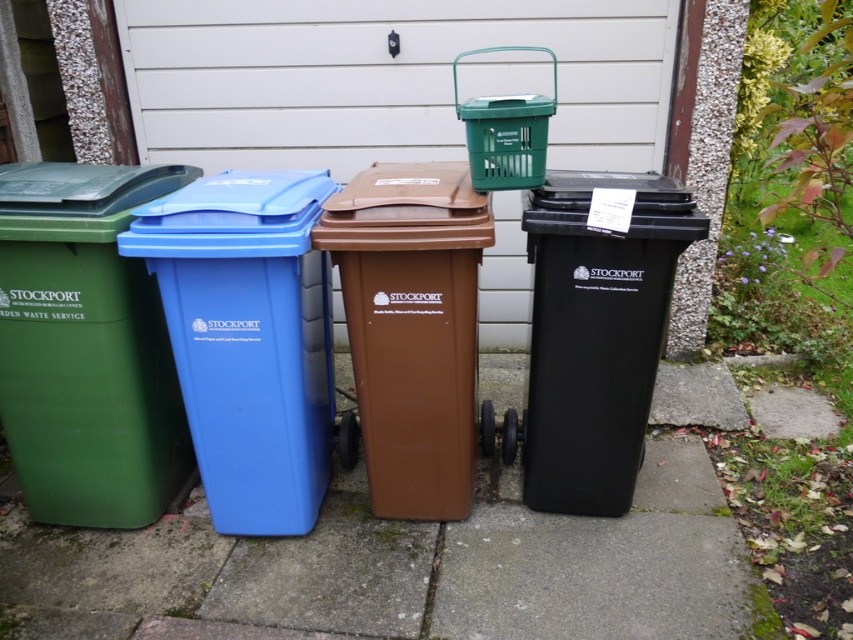
Question: Which point is farther to the camera?

Choices:
 (A) (86, 515)
 (B) (532, 291)
 (C) (723, 582)

Answer: (A)

Question: Is brown matte plastic recycling bin at center further to the viewer compared to black plastic recycling bin at right?

Choices:
 (A) no
 (B) yes

Answer: (A)

Question: Which of the following is the closest to the observer?

Choices:
 (A) green concrete pavement at lower center
 (B) green plastic recycling bin at left
 (C) blue plastic recycling bin at left

Answer: (C)

Question: Does green plastic recycling bin at left come behind blue plastic recycling bin at left?

Choices:
 (A) no
 (B) yes

Answer: (B)

Question: Which object is the closest to the blue plastic recycling bin at left?

Choices:
 (A) green concrete pavement at lower center
 (B) green plastic recycling bin at left

Answer: (B)

Question: Does green concrete pavement at lower center lie in front of brown matte plastic recycling bin at center?

Choices:
 (A) yes
 (B) no

Answer: (B)